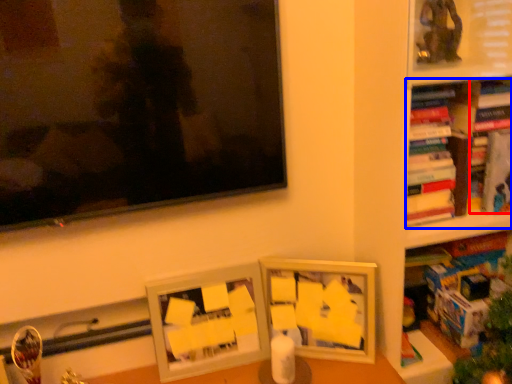
Question: Which point is further to the camera, book (highlighted by a red box) or book (highlighted by a blue box)?

Choices:
 (A) book
 (B) book

Answer: (A)